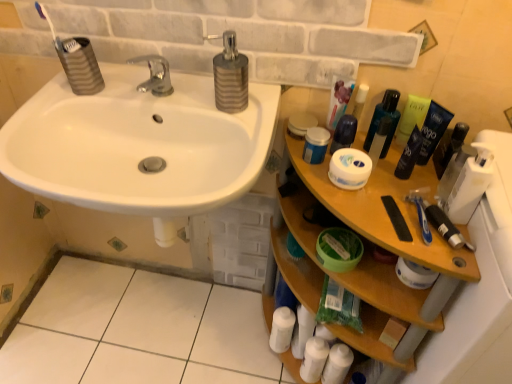
This screenshot has width=512, height=384. Identify the location of free space above white tile at lower left (from a real-world perspective). (137, 329).